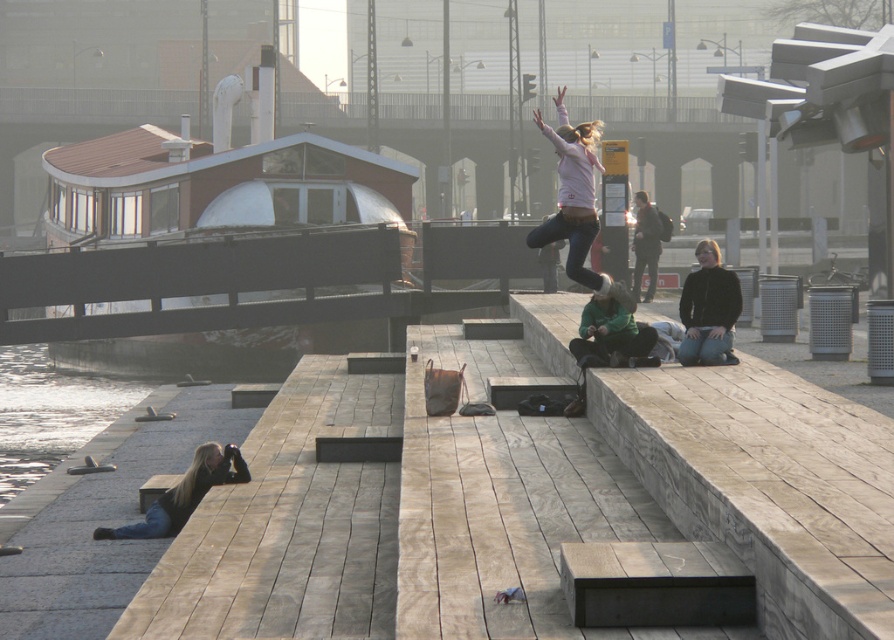
You are a photographer trying to capture a group photo of the people in the scene. You want to ensure that both the matte pink sweater at upper center and the blonde hair at lower left are clearly visible in the frame. Based on their positions, which object is closer to the camera, and would require you to focus on it first?

The blonde hair at lower left is closer to the camera than the matte pink sweater at upper center, so you should focus on the blonde hair at lower left first to ensure clarity.

You are a fashion designer observing the urban riverside scene. You need to determine which clothing item, the matte pink sweater at upper center or the dark brown leather jacket at upper center, would be more suitable for a large frame. Based on the scene, which one do you recommend?

The matte pink sweater at upper center has a larger size compared to the dark brown leather jacket at upper center, making it more suitable for a large frame.